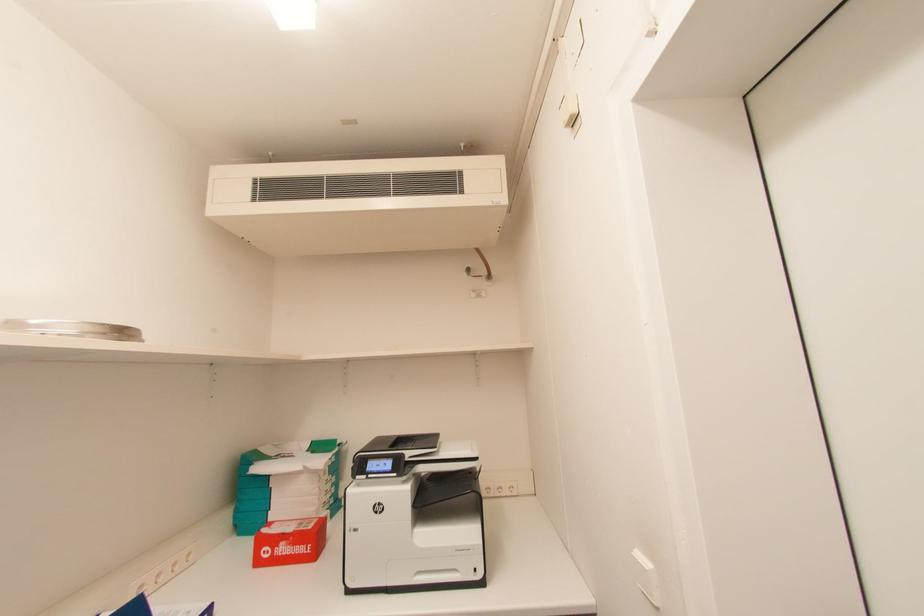
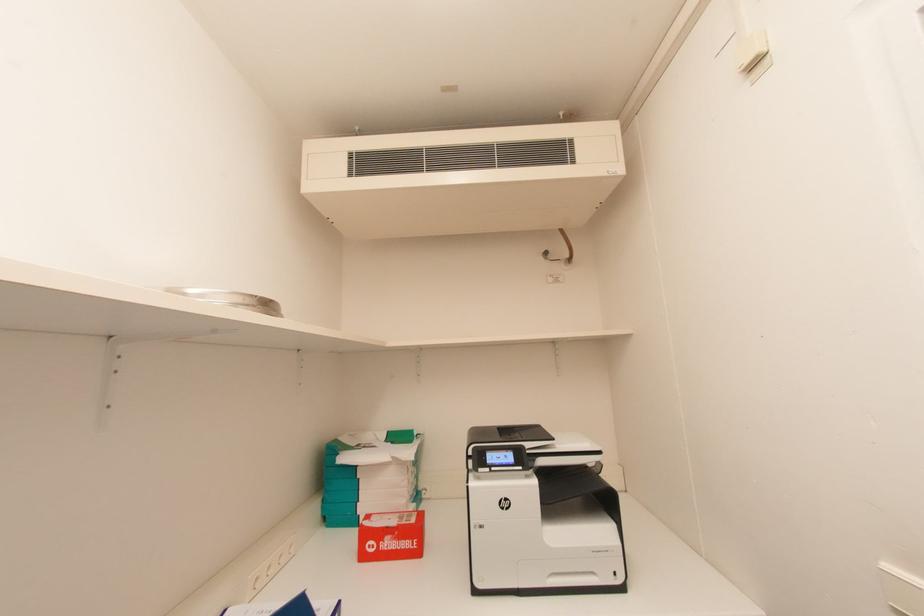
Question: In a continuous first-person perspective shot, in which direction is the camera moving?

Choices:
 (A) Left
 (B) Right
 (C) Forward
 (D) Backward

Answer: (A)